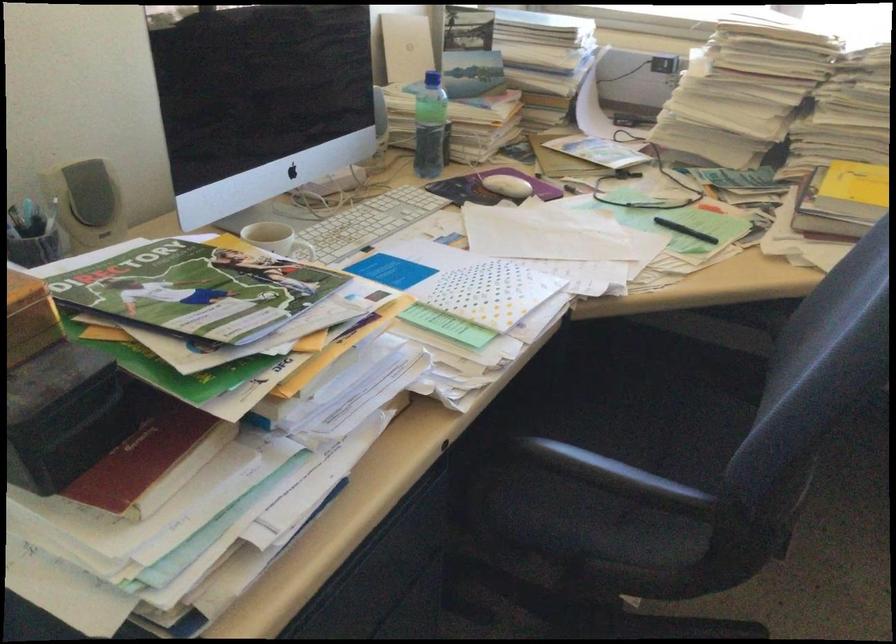
This screenshot has width=896, height=644. In order to click on chair sitting surface in this screenshot , I will do `click(653, 411)`.